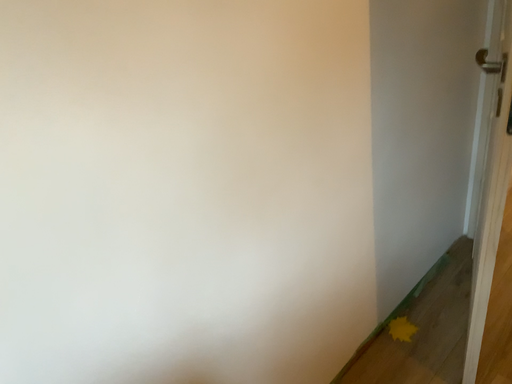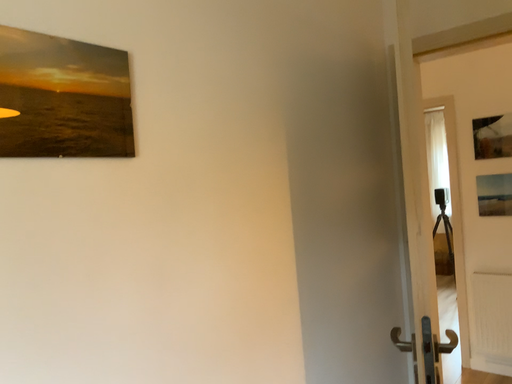
Question: Which way did the camera rotate in the video?

Choices:
 (A) rotated right
 (B) rotated left

Answer: (A)